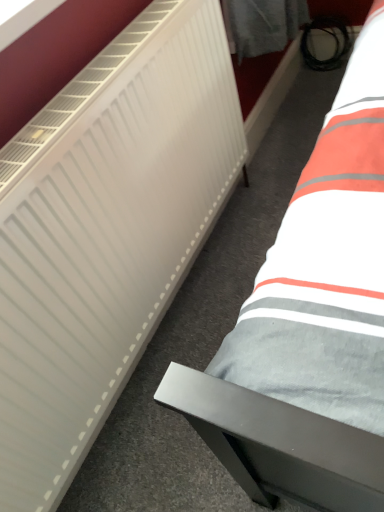
Question: From a real-world perspective, is gray fabric bed at lower right physically above white matte radiator at left?

Choices:
 (A) yes
 (B) no

Answer: (B)

Question: Does gray fabric bed at lower right appear on the right side of white matte radiator at left?

Choices:
 (A) no
 (B) yes

Answer: (B)

Question: Is gray fabric bed at lower right further to camera compared to white matte radiator at left?

Choices:
 (A) yes
 (B) no

Answer: (A)

Question: From the image's perspective, is gray fabric bed at lower right over white matte radiator at left?

Choices:
 (A) yes
 (B) no

Answer: (A)

Question: Is gray fabric bed at lower right shorter than white matte radiator at left?

Choices:
 (A) yes
 (B) no

Answer: (A)

Question: Is gray fabric bed at lower right with white matte radiator at left?

Choices:
 (A) no
 (B) yes

Answer: (A)

Question: From the image's perspective, is white matte radiator at left located beneath gray fabric bed at lower right?

Choices:
 (A) no
 (B) yes

Answer: (B)

Question: Can you see white matte radiator at left touching gray fabric bed at lower right?

Choices:
 (A) yes
 (B) no

Answer: (B)

Question: Is white matte radiator at left outside of gray fabric bed at lower right?

Choices:
 (A) no
 (B) yes

Answer: (B)

Question: Is white matte radiator at left smaller than gray fabric bed at lower right?

Choices:
 (A) yes
 (B) no

Answer: (B)

Question: Is white matte radiator at left turned away from gray fabric bed at lower right?

Choices:
 (A) yes
 (B) no

Answer: (B)

Question: Is the position of white matte radiator at left more distant than that of gray fabric bed at lower right?

Choices:
 (A) yes
 (B) no

Answer: (B)

Question: Considering the positions of white matte radiator at left and gray fabric bed at lower right in the image, is white matte radiator at left wider or thinner than gray fabric bed at lower right?

Choices:
 (A) wide
 (B) thin

Answer: (B)